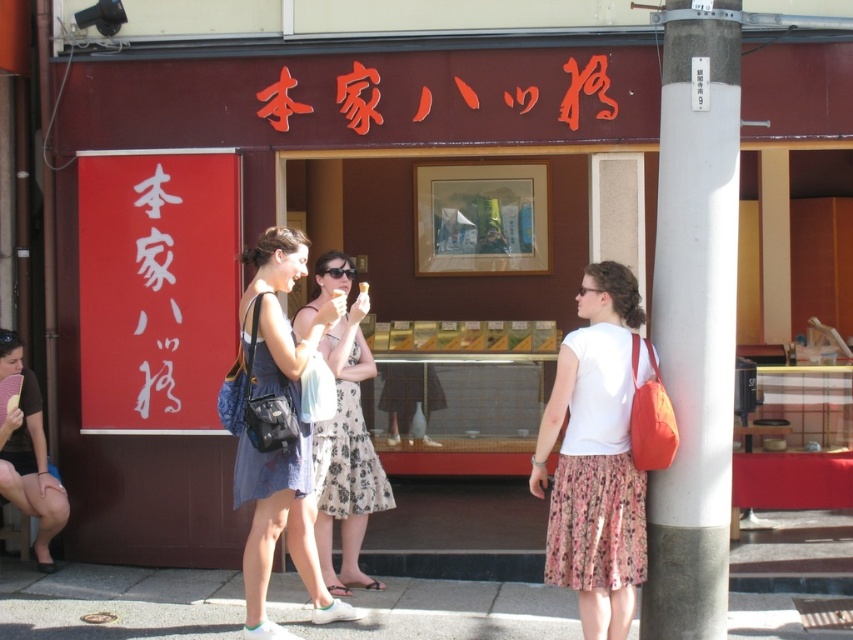
Question: Which point is closer to the camera?

Choices:
 (A) (514, 97)
 (B) (94, 579)
 (C) (666, 573)
 (D) (364, 282)

Answer: (C)

Question: Is denim dress at center wider than red matte sign at center?

Choices:
 (A) no
 (B) yes

Answer: (A)

Question: Which of the following is the farthest from the observer?

Choices:
 (A) (361, 285)
 (B) (686, 620)
 (C) (573, 387)
 (D) (364, 444)

Answer: (D)

Question: Does concrete sidewalk at lower center appear under brown leather purse at lower left?

Choices:
 (A) yes
 (B) no

Answer: (A)

Question: Can you confirm if concrete sidewalk at lower center is positioned to the right of floral dress at center?

Choices:
 (A) yes
 (B) no

Answer: (B)

Question: Which object appears closest to the camera in this image?

Choices:
 (A) brown leather purse at lower left
 (B) white concrete pole at center right
 (C) denim dress at center

Answer: (B)